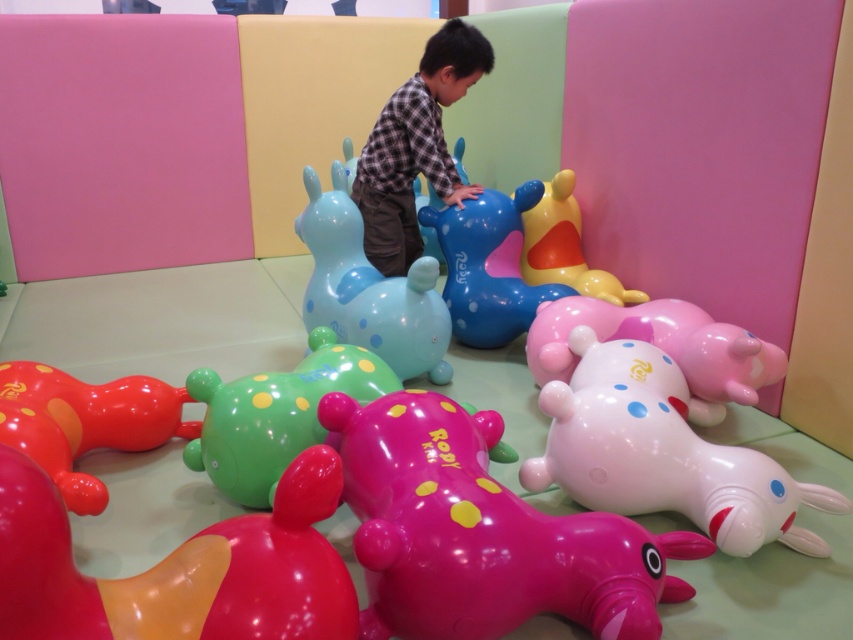
Between pink rubber dog at center and rubber duck at lower left, which one appears on the left side from the viewer's perspective?

Positioned to the left is rubber duck at lower left.

Does pink rubber dog at center have a smaller size compared to rubber duck at lower left?

No, pink rubber dog at center is not smaller than rubber duck at lower left.

Locate an element on the screen. pink rubber dog at center is located at coordinates (662, 452).

Is point (691, 429) positioned before point (405, 205)?

Yes, it is.

Which is in front, point (672, 493) or point (457, 48)?

Positioned in front is point (672, 493).

Does point (665, 369) come farther from viewer compared to point (402, 257)?

No, it is in front of (402, 257).

Where is `pink rubber dog at center`? The image size is (853, 640). pink rubber dog at center is located at coordinates (662, 452).

Based on the photo, does green rubber dog at center appear under rubber duck at upper right?

Indeed, green rubber dog at center is positioned under rubber duck at upper right.

Is point (311, 340) behind point (526, 237)?

No, (311, 340) is in front of (526, 237).

The width and height of the screenshot is (853, 640). In order to click on green rubber dog at center in this screenshot , I will do `click(276, 413)`.

Locate an element on the screen. The image size is (853, 640). green rubber dog at center is located at coordinates (276, 413).